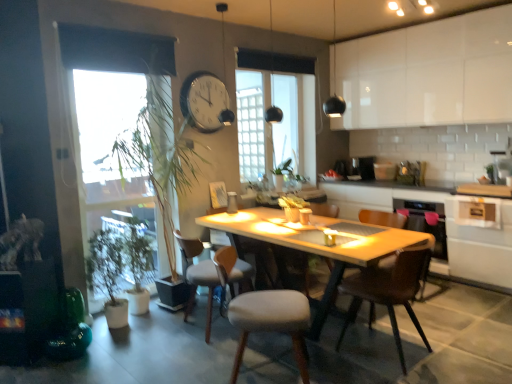
I want to click on green leafy plant at left, so click(x=106, y=219).

Identify the location of clear glass window at center. This screenshot has height=384, width=512. (276, 106).

What is the approximate width of wooden chair at center, the first chair from the back?

wooden chair at center, the first chair from the back, is 23.10 inches wide.

Where is `green leafy plant at left`? The image size is (512, 384). green leafy plant at left is located at coordinates (106, 219).

From the image's perspective, starting from the light gray fabric chair at center, arranged as the fifth chair when viewed from the back, which chair is the 2nd one above? Please provide its 2D coordinates.

[(198, 276)]

Choose the correct answer: Is light gray fabric chair at center, acting as the 3th chair starting from the front, inside light gray fabric chair at center, which appears as the first chair when viewed from the front, or outside it?

light gray fabric chair at center, acting as the 3th chair starting from the front, is not enclosed by light gray fabric chair at center, which appears as the first chair when viewed from the front.

Considering the points (192, 264) and (251, 304), which point is in front, point (192, 264) or point (251, 304)?

The point (251, 304) is closer.

From the image's perspective, does light gray fabric chair at center, acting as the 3th chair starting from the front, appear lower than light gray fabric chair at center, which appears as the first chair when viewed from the front?

No.

Could you measure the distance between white glossy counter at center and wooden chair at center, the first chair from the back?

3.49 feet.

Is white glossy counter at center not inside wooden chair at center, the first chair from the back?

Indeed, white glossy counter at center is completely outside wooden chair at center, the first chair from the back.

From a real-world perspective, who is located lower, white glossy counter at center or wooden chair at center, the first chair from the back?

From a 3D spatial view, wooden chair at center, the first chair from the back, is below.

Which of these two, white glossy counter at center or wooden chair at center, the first chair from the back, is bigger?

white glossy counter at center is bigger.

Find the location of `cabinetry that is the 2nd object located behind the light gray fabric chair at center, acting as the 3th chair starting from the front`. cabinetry that is the 2nd object located behind the light gray fabric chair at center, acting as the 3th chair starting from the front is located at coordinates pos(428,74).

Who is taller, light gray fabric chair at center, acting as the 3th chair starting from the front, or white glossy cabinet at upper right, the 1th cabinetry in the top-to-bottom sequence?

white glossy cabinet at upper right, the 1th cabinetry in the top-to-bottom sequence, is taller.

From a real-world perspective, relative to white glossy cabinet at upper right, the 1th cabinetry in the top-to-bottom sequence, is light gray fabric chair at center, acting as the 3th chair starting from the front, vertically above or below?

light gray fabric chair at center, acting as the 3th chair starting from the front, is below white glossy cabinet at upper right, the 1th cabinetry in the top-to-bottom sequence.

Considering the sizes of objects light gray fabric chair at center, acting as the 3th chair starting from the front, and white glossy cabinet at upper right, the 1th cabinetry in the top-to-bottom sequence, in the image provided, who is wider, light gray fabric chair at center, acting as the 3th chair starting from the front, or white glossy cabinet at upper right, the 1th cabinetry in the top-to-bottom sequence,?

With larger width is light gray fabric chair at center, acting as the 3th chair starting from the front.

From the image's perspective, is wooden chair at center, which ranks as the 5th chair in front-to-back order, above or below white glossy cabinet at lower right, which is counted as the first cabinetry, starting from the bottom?

wooden chair at center, which ranks as the 5th chair in front-to-back order, is situated lower than white glossy cabinet at lower right, which is counted as the first cabinetry, starting from the bottom, in the image.

What's the angular difference between wooden chair at center, the first chair from the back, and white glossy cabinet at lower right, which is counted as the first cabinetry, starting from the bottom,'s facing directions?

1.61 degrees separate the facing orientations of wooden chair at center, the first chair from the back, and white glossy cabinet at lower right, which is counted as the first cabinetry, starting from the bottom.

Does wooden chair at center, which ranks as the 5th chair in front-to-back order, have a smaller size compared to white glossy cabinet at lower right, which ranks as the 2th cabinetry in top-to-bottom order?

Yes.

From the picture: Could you tell me if wooden chair at center, the first chair from the back, is turned towards white glossy cabinet at lower right, which is counted as the first cabinetry, starting from the bottom?

No, wooden chair at center, the first chair from the back, is not turned towards white glossy cabinet at lower right, which is counted as the first cabinetry, starting from the bottom.

Which of these two, light gray fabric chair at center, the fourth chair when ordered from front to back, or white glossy cabinet at lower right, which ranks as the 2th cabinetry in top-to-bottom order, is wider?

white glossy cabinet at lower right, which ranks as the 2th cabinetry in top-to-bottom order.

From the image's perspective, is light gray fabric chair at center, the second chair in the back-to-front sequence, above or below white glossy cabinet at lower right, which ranks as the 2th cabinetry in top-to-bottom order?

light gray fabric chair at center, the second chair in the back-to-front sequence, is situated lower than white glossy cabinet at lower right, which ranks as the 2th cabinetry in top-to-bottom order, in the image.

Is light gray fabric chair at center, the fourth chair when ordered from front to back, completely or partially outside of white glossy cabinet at lower right, which is counted as the first cabinetry, starting from the bottom?

Yes.

Considering the positions of objects light gray fabric chair at center, the fourth chair when ordered from front to back, and white glossy cabinet at lower right, which ranks as the 2th cabinetry in top-to-bottom order, in the image provided, who is more to the left, light gray fabric chair at center, the fourth chair when ordered from front to back, or white glossy cabinet at lower right, which ranks as the 2th cabinetry in top-to-bottom order,?

Positioned to the left is light gray fabric chair at center, the fourth chair when ordered from front to back.

Does point (271, 316) come farther from viewer compared to point (306, 292)?

No, it is not.

Consider the image. Does light gray fabric chair at center, which appears as the first chair when viewed from the front, have a lesser width compared to wooden chair at center, the first chair from the back?

No.

Could you tell me if light gray fabric chair at center, arranged as the fifth chair when viewed from the back, is turned towards wooden chair at center, the first chair from the back?

No, light gray fabric chair at center, arranged as the fifth chair when viewed from the back, does not turn towards wooden chair at center, the first chair from the back.

Is light gray fabric chair at center, arranged as the fifth chair when viewed from the back, not near wooden chair at center, which ranks as the 5th chair in front-to-back order?

Absolutely, light gray fabric chair at center, arranged as the fifth chair when viewed from the back, is distant from wooden chair at center, which ranks as the 5th chair in front-to-back order.

Considering the relative sizes of light gray fabric chair at center, acting as the 3th chair starting from the front, and wooden chair at center, which ranks as the 5th chair in front-to-back order, in the image provided, is light gray fabric chair at center, acting as the 3th chair starting from the front, thinner than wooden chair at center, which ranks as the 5th chair in front-to-back order,?

Incorrect, the width of light gray fabric chair at center, acting as the 3th chair starting from the front, is not less than that of wooden chair at center, which ranks as the 5th chair in front-to-back order.

From a real-world perspective, relative to wooden chair at center, which ranks as the 5th chair in front-to-back order, is light gray fabric chair at center, acting as the 3th chair starting from the front, vertically above or below?

light gray fabric chair at center, acting as the 3th chair starting from the front, is below wooden chair at center, which ranks as the 5th chair in front-to-back order.

Can wooden chair at center, the first chair from the back, be found inside light gray fabric chair at center, acting as the 3th chair starting from the front?

Actually, wooden chair at center, the first chair from the back, is outside light gray fabric chair at center, acting as the 3th chair starting from the front.

Relative to wooden chair at center, the first chair from the back, is light gray fabric chair at center, positioned as the 3th chair in back-to-front order, in front or behind?

Clearly, light gray fabric chair at center, positioned as the 3th chair in back-to-front order, is in front of wooden chair at center, the first chair from the back.

I want to click on chair directly beneath the light gray fabric chair at center, which appears as the first chair when viewed from the front (from a real-world perspective), so click(198, 276).

Image resolution: width=512 pixels, height=384 pixels. I want to click on counter positioned vertically above the wooden chair at center, which ranks as the 5th chair in front-to-back order (from a real-world perspective), so click(446, 230).

From the image, which object appears to be nearer to light gray fabric chair at center, which appears as the first chair when viewed from the front, white glossy counter at center or light gray fabric chair at center, the second chair in the back-to-front sequence?

The object closer to light gray fabric chair at center, which appears as the first chair when viewed from the front, is light gray fabric chair at center, the second chair in the back-to-front sequence.

From the image, which object appears to be farther from white glossy counter at center, white plastic clock at upper center or light gray fabric chair at center, positioned as the 3th chair in back-to-front order?

light gray fabric chair at center, positioned as the 3th chair in back-to-front order.

Considering their positions, is green leafy plant at left positioned further to white plastic clock at upper center than white glossy cabinet at upper right, the second cabinetry when ordered from bottom to top?

The object further to white plastic clock at upper center is white glossy cabinet at upper right, the second cabinetry when ordered from bottom to top.

From the image, which object appears to be farther from white glossy cabinet at upper right, the 1th cabinetry in the top-to-bottom sequence, transparent glass window screen at left or light gray fabric chair at center, the fourth chair when ordered from front to back?

transparent glass window screen at left lies further to white glossy cabinet at upper right, the 1th cabinetry in the top-to-bottom sequence, than the other object.

Which object lies nearer to the anchor point clear glass window at center, wooden chair at center, the first chair from the back, or brown leather chair at center, the fourth chair viewed from the back?

The object closer to clear glass window at center is wooden chair at center, the first chair from the back.

When comparing their distances from wooden chair at center, which ranks as the 5th chair in front-to-back order, does green leafy plant at left or light gray fabric chair at center, positioned as the 3th chair in back-to-front order, seem further?

green leafy plant at left lies further to wooden chair at center, which ranks as the 5th chair in front-to-back order, than the other object.

Looking at the image, which one is located closer to transparent glass window screen at left, clear glass window at center or green leafy plant at left?

green leafy plant at left lies closer to transparent glass window screen at left than the other object.

Based on their spatial positions, is white glossy counter at center or green leafy plant at left further from light gray fabric chair at center, acting as the 3th chair starting from the front?

white glossy counter at center is positioned further to the anchor light gray fabric chair at center, acting as the 3th chair starting from the front.

Identify the location of chair between white glossy cabinet at upper right, the 1th cabinetry in the top-to-bottom sequence, and light gray fabric chair at center, the second chair in the back-to-front sequence, in the up-down direction. This screenshot has height=384, width=512. (325, 209).

Identify the location of plant between white plastic clock at upper center and light gray fabric chair at center, acting as the 3th chair starting from the front, vertically. Image resolution: width=512 pixels, height=384 pixels. (106, 219).

Locate an element on the screen. The width and height of the screenshot is (512, 384). window between green leafy plant at left and white glossy counter at center from left to right is located at coordinates (276, 106).

Image resolution: width=512 pixels, height=384 pixels. In order to click on window screen situated between green leafy plant at left and light gray fabric chair at center, the second chair in the back-to-front sequence, from left to right in this screenshot , I will do `click(109, 98)`.